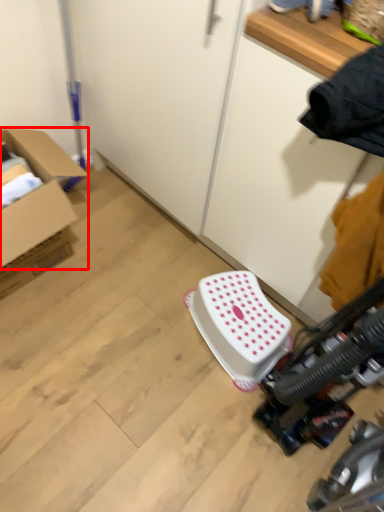
Question: From the image's perspective, what is the correct spatial relationship of box (annotated by the red box) in relation to stool?

Choices:
 (A) above
 (B) below

Answer: (A)